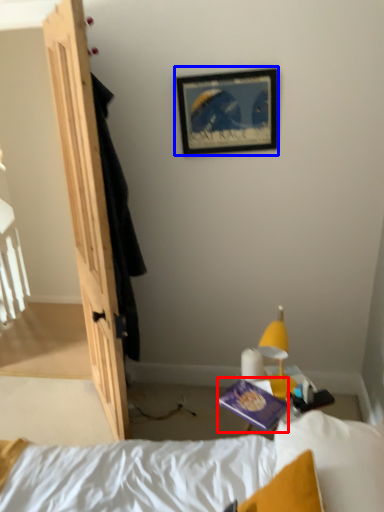
Question: Which point is closer to the camera, paperback book (highlighted by a red box) or picture frame (highlighted by a blue box)?

Choices:
 (A) paperback book
 (B) picture frame

Answer: (A)